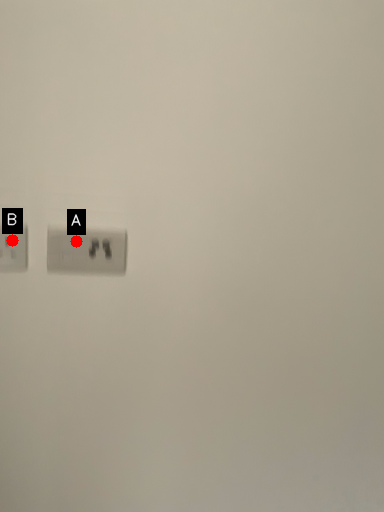
Question: Two points are circled on the image, labeled by A and B beside each circle. Which point appears farthest from the camera in this image?

Choices:
 (A) A is further
 (B) B is further

Answer: (A)